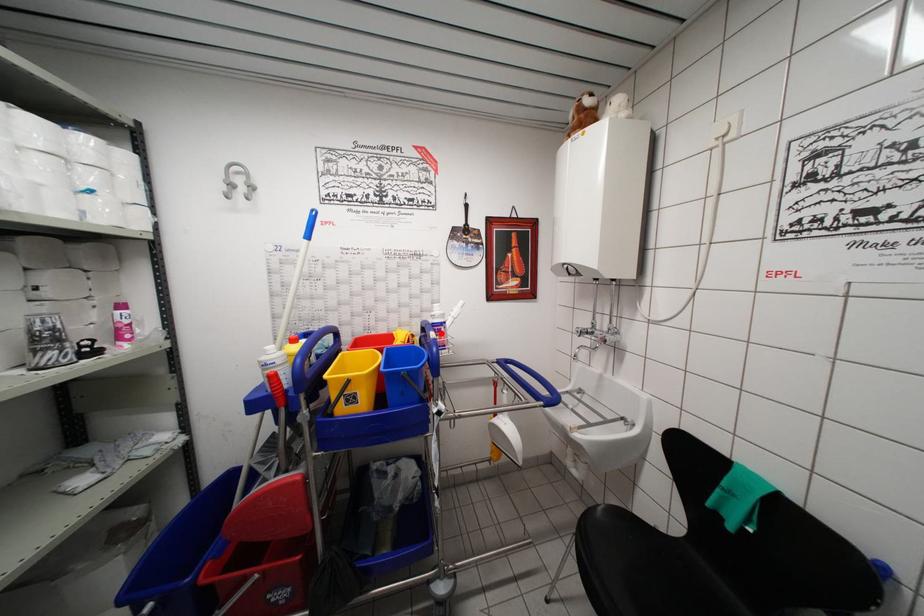
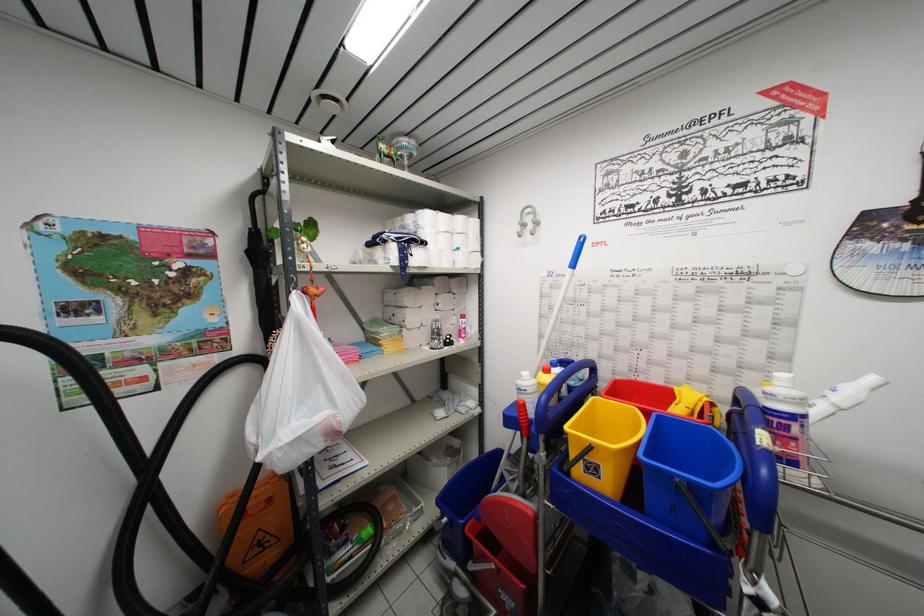
Where in the second image is the point corresponding to the highlighted location from the first image?

(783, 428)